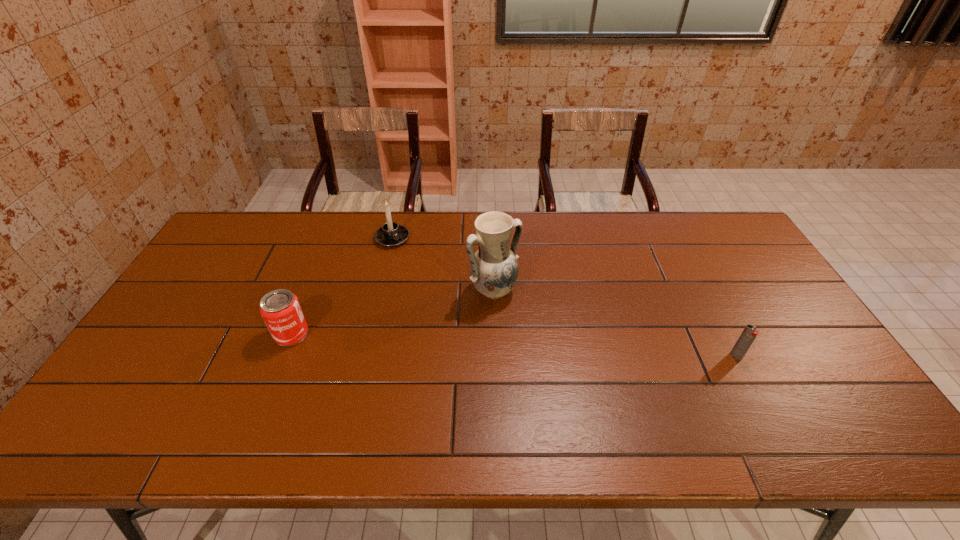
This screenshot has height=540, width=960. Identify the location of free point at the right edge. (725, 258).

The height and width of the screenshot is (540, 960). In order to click on free space at the far left corner of the desktop in this screenshot , I will do (248, 243).

I want to click on free space at the far right corner of the desktop, so click(x=704, y=217).

Find the location of a particular element. free spot between the nearest object and the can is located at coordinates (514, 345).

Where is `vacant area that lies between the candle holder and the can`? This screenshot has width=960, height=540. vacant area that lies between the candle holder and the can is located at coordinates (342, 286).

This screenshot has width=960, height=540. What are the coordinates of `blank region between the nearest object and the leftmost object` in the screenshot? It's located at (514, 345).

Where is `free space between the second object from right to left and the candle holder`? free space between the second object from right to left and the candle holder is located at coordinates (443, 265).

The image size is (960, 540). What are the coordinates of `unoccupied position between the candle holder and the third farthest object` in the screenshot? It's located at (342, 286).

You are a GUI agent. You are given a task and a screenshot of the screen. Output one action in this format:
    pyautogui.click(x=<x>, y=<y>)
    Task: Click on the vacant area that lies between the tallest object and the rightmost object
    The width and height of the screenshot is (960, 540).
    Given the screenshot: What is the action you would take?
    pyautogui.click(x=614, y=323)

Identify the location of vacant point located between the candle holder and the rightmost object. (564, 297).